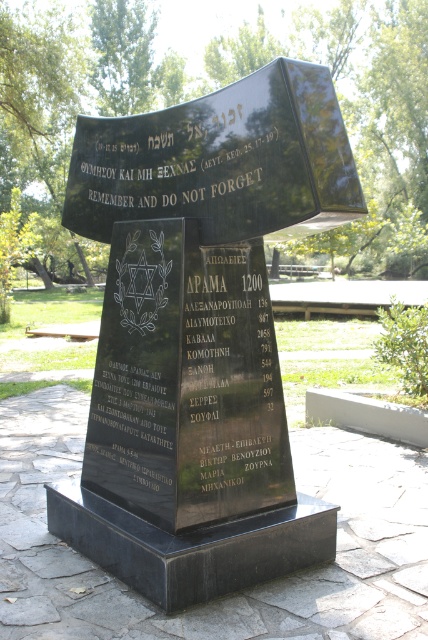
Question: Which point is closer to the camera taking this photo?

Choices:
 (A) coord(219,436)
 (B) coord(244,506)

Answer: (A)

Question: Among these objects, which one is nearest to the camera?

Choices:
 (A) black stone plaque at center
 (B) black polished stone at center

Answer: (A)

Question: Is black polished stone monument at center positioned in front of black stone plaque at center?

Choices:
 (A) no
 (B) yes

Answer: (B)

Question: In this image, where is black polished stone monument at center located relative to black stone plaque at center?

Choices:
 (A) right
 (B) left

Answer: (A)

Question: Which object appears farthest from the camera in this image?

Choices:
 (A) black polished stone monument at center
 (B) black polished stone at center
 (C) black stone plaque at center

Answer: (B)

Question: Does black polished stone monument at center have a larger size compared to black stone plaque at center?

Choices:
 (A) no
 (B) yes

Answer: (B)